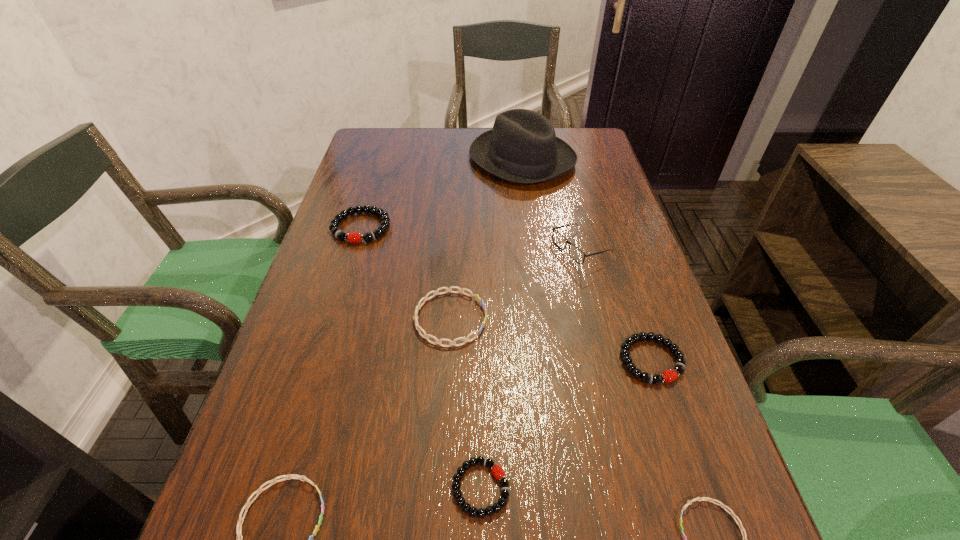
The image size is (960, 540). Identify the location of blue bracelet that stands as the second closest to the biggest blue bracelet. (721, 504).

This screenshot has height=540, width=960. I want to click on vacant space that satisfies the following two spatial constraints: 1. on the surface of the biggest blue bracelet showing star-shaped elements; 2. on the back side of the nearest black bracelet, so click(441, 488).

At what (x,y) coordinates should I click in order to perform the action: click on free space in the image that satisfies the following two spatial constraints: 1. on the surface of the second blue bracelet from left to right showing star-shaped elements; 2. on the left side of the rightmost black bracelet. Please return your answer as a coordinate pair (x, y). The width and height of the screenshot is (960, 540). Looking at the image, I should click on (448, 360).